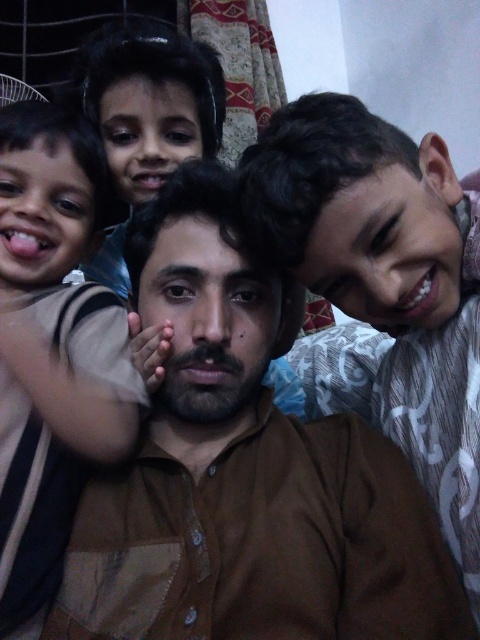
Can you confirm if brown cotton shirt at center is thinner than brown striped shirt at left?

No.

Is point (334, 627) behind point (88, 397)?

No, (334, 627) is in front of (88, 397).

Find the location of a particular element. Image resolution: width=480 pixels, height=640 pixels. brown cotton shirt at center is located at coordinates (243, 474).

This screenshot has height=640, width=480. Identify the location of brown cotton shirt at center. (243, 474).